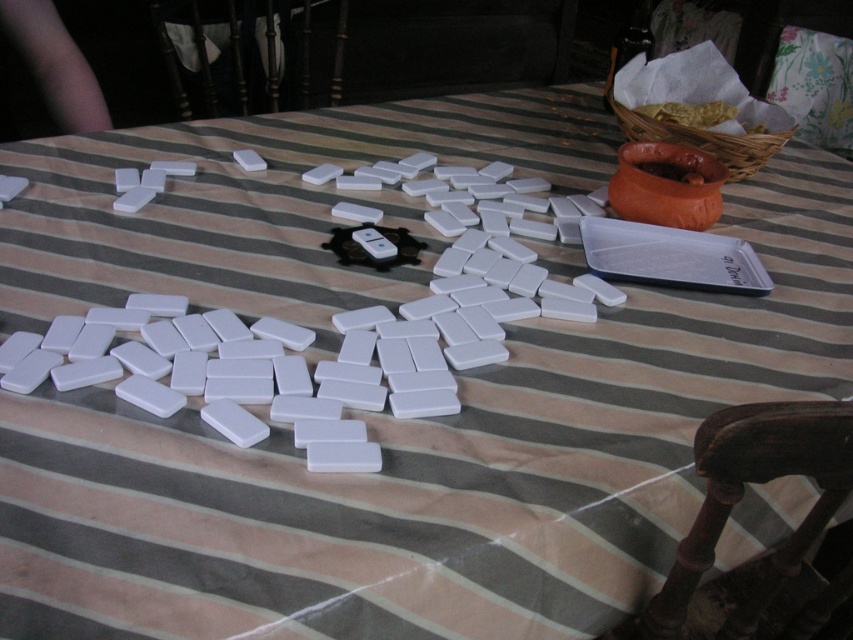
Question: Which object is farther from the camera taking this photo?

Choices:
 (A) brown wooden chair at lower right
 (B) black metal chair at upper left

Answer: (B)

Question: Can you confirm if white matte dominoes at center is positioned to the left of black metal chair at upper left?

Choices:
 (A) no
 (B) yes

Answer: (A)

Question: Which object is closer to the camera taking this photo?

Choices:
 (A) white matte dominoes at center
 (B) black metal chair at upper left
 (C) brown wooden chair at lower right

Answer: (C)

Question: Which point appears farthest from the camera in this image?

Choices:
 (A) (267, 3)
 (B) (312, 428)
 (C) (828, 445)

Answer: (A)

Question: Can you confirm if white matte dominoes at center is positioned to the left of black metal chair at upper left?

Choices:
 (A) no
 (B) yes

Answer: (A)

Question: Considering the relative positions of brown wooden chair at lower right and black metal chair at upper left in the image provided, where is brown wooden chair at lower right located with respect to black metal chair at upper left?

Choices:
 (A) right
 (B) left

Answer: (A)